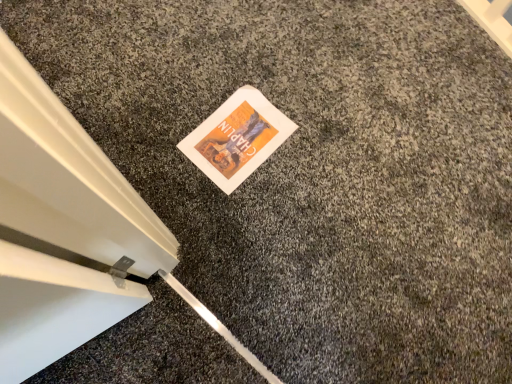
The image size is (512, 384). What are the coordinates of `space that is in front of white paper at center` in the screenshot? It's located at (230, 213).